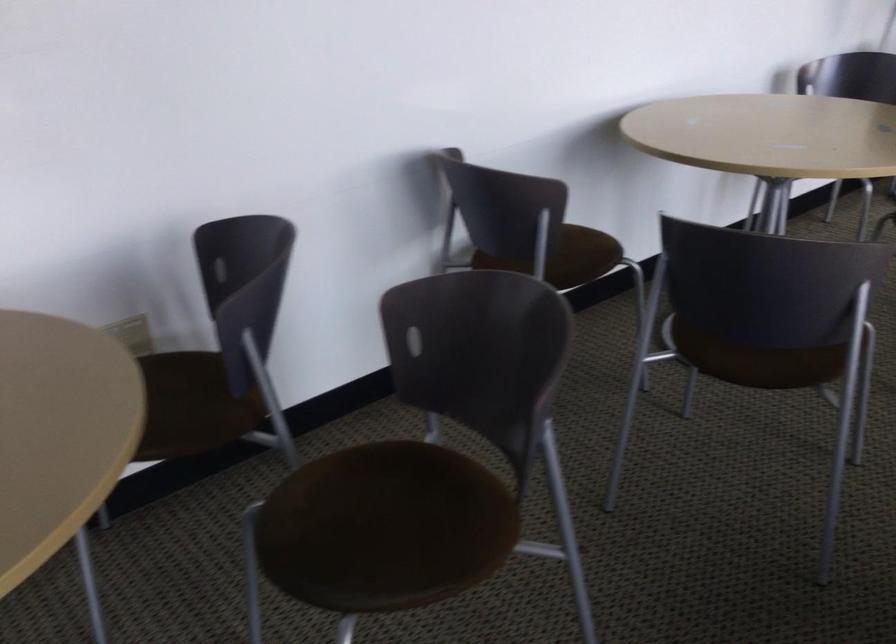
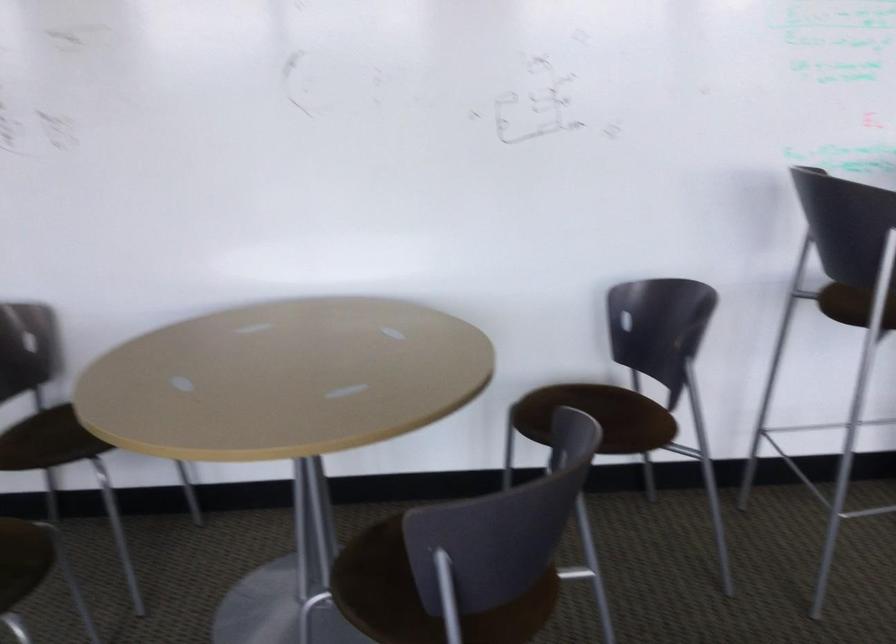
In the second image, find the point that corresponds to pixel 570 265 in the first image.

(26, 442)